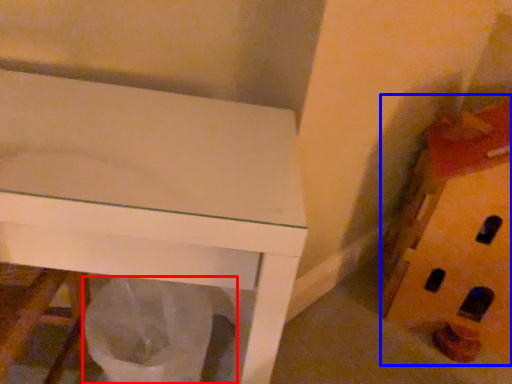
Question: Which point is further to the camera, garbage (highlighted by a red box) or toy (highlighted by a blue box)?

Choices:
 (A) garbage
 (B) toy

Answer: (B)